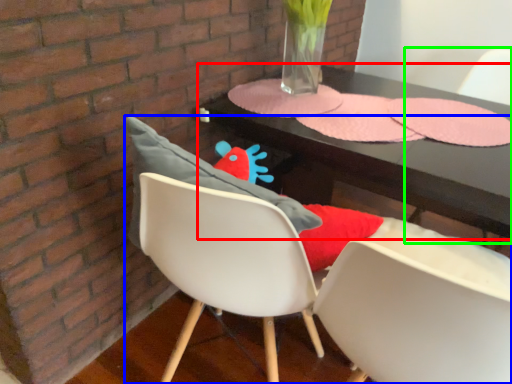
Question: Considering the real-world distances, which object is closest to table (highlighted by a red box)? chair (highlighted by a blue box) or armchair (highlighted by a green box).

Choices:
 (A) chair
 (B) armchair

Answer: (A)